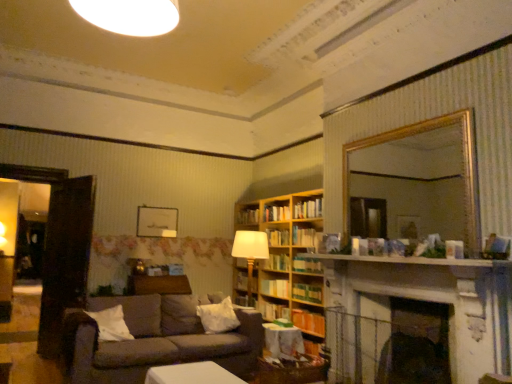
Image resolution: width=512 pixels, height=384 pixels. Identify the location of vacant area on top of gold-framed mirror at upper right (from a real-world perspective). (400, 126).